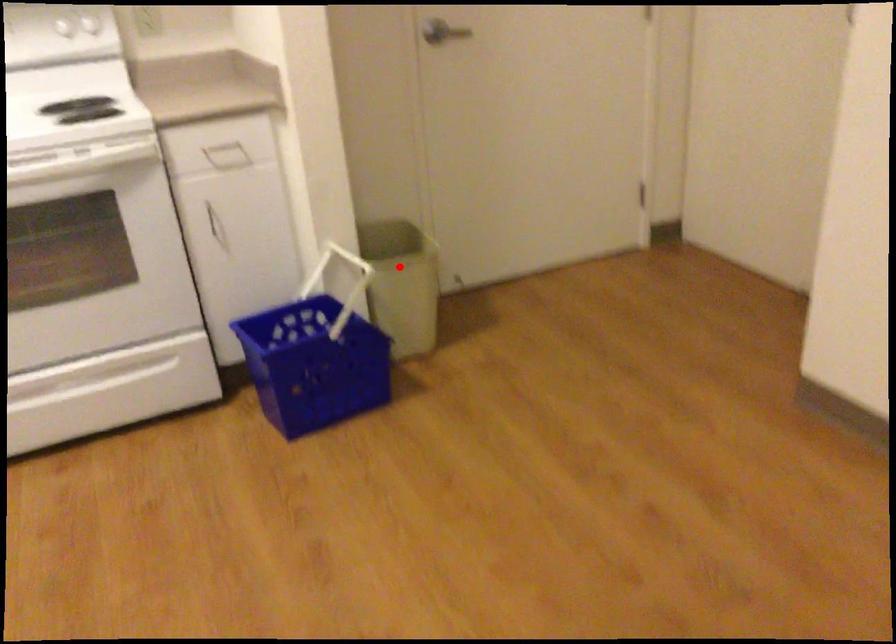
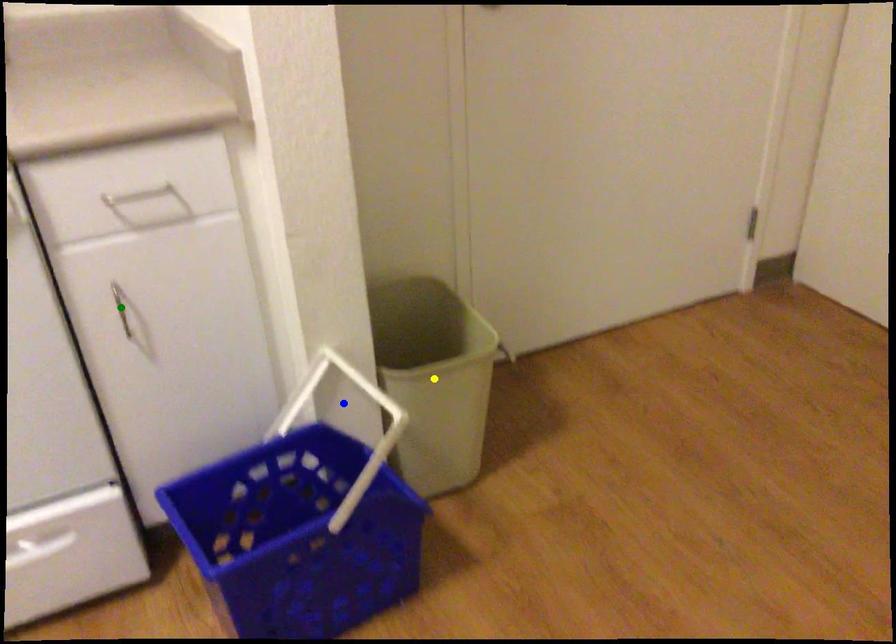
Question: I am providing you with two images of the same scene from different viewpoints. A red point is marked on the first image. You are given multiple points on the second image. Which spot in image 2 lines up with the point in image 1?

Choices:
 (A) yellow point
 (B) blue point
 (C) green point

Answer: (A)